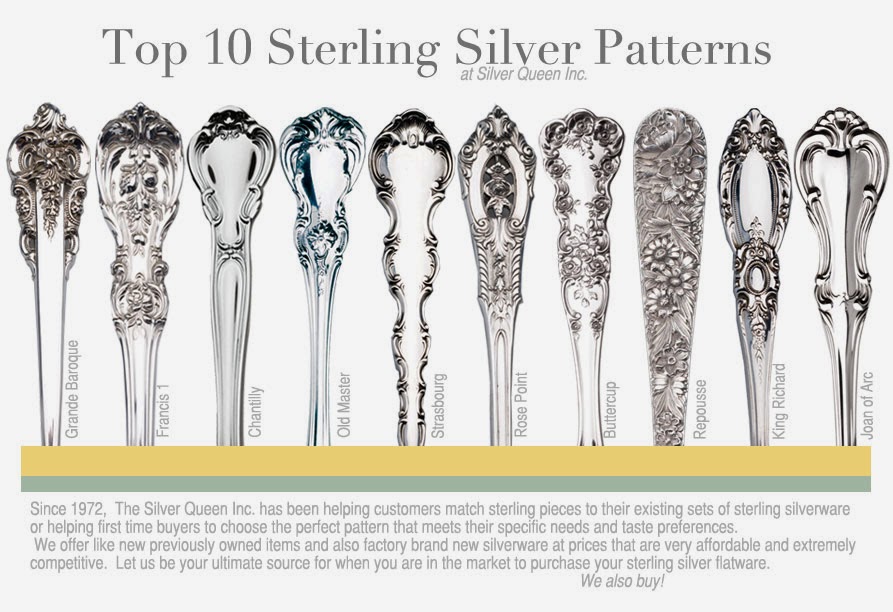
Find the location of a particular element. handle is located at coordinates (56, 162), (144, 185), (235, 169), (337, 166), (418, 166), (503, 177), (588, 180), (673, 182), (758, 193), (849, 192).